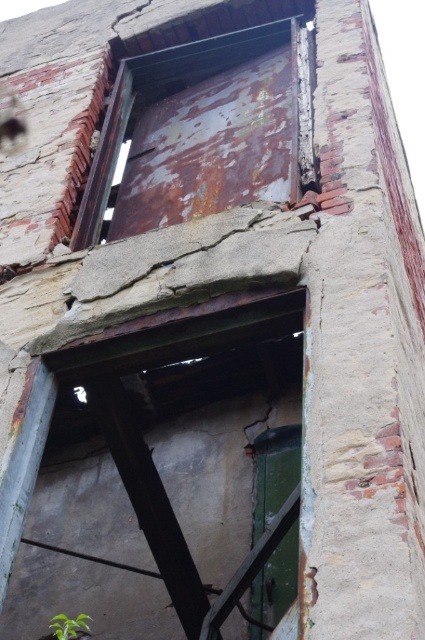
Question: Does rusty metal door at center appear on the left side of rusty metal door at upper center?

Choices:
 (A) no
 (B) yes

Answer: (A)

Question: Which object is farther from the camera taking this photo?

Choices:
 (A) rusty metal door at center
 (B) rusty metal door at upper center

Answer: (B)

Question: Does rusty metal door at center have a greater width compared to rusty metal door at upper center?

Choices:
 (A) yes
 (B) no

Answer: (A)

Question: Which point appears farthest from the camera in this image?

Choices:
 (A) (164, 96)
 (B) (104, 528)

Answer: (B)

Question: Among these objects, which one is farthest from the camera?

Choices:
 (A) rusty metal door at center
 (B) rusty metal door at upper center

Answer: (B)

Question: Does rusty metal door at center have a larger size compared to rusty metal door at upper center?

Choices:
 (A) yes
 (B) no

Answer: (A)